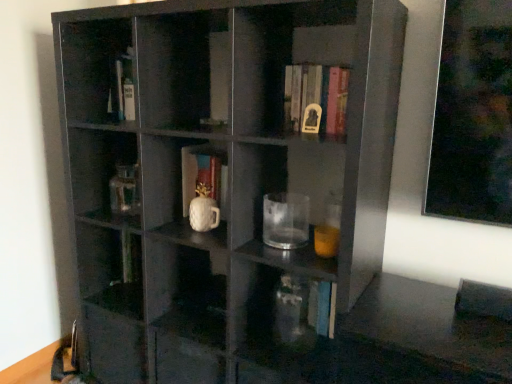
Question: Is transparent glass mug at center positioned before matte black shelf at center?

Choices:
 (A) yes
 (B) no

Answer: (B)

Question: Is transparent glass mug at center wider than matte black shelf at center?

Choices:
 (A) no
 (B) yes

Answer: (A)

Question: Is transparent glass mug at center facing away from matte black shelf at center?

Choices:
 (A) no
 (B) yes

Answer: (B)

Question: Can you confirm if transparent glass mug at center is bigger than matte black shelf at center?

Choices:
 (A) no
 (B) yes

Answer: (A)

Question: Considering the relative positions of transparent glass mug at center and matte black shelf at center in the image provided, is transparent glass mug at center to the left of matte black shelf at center from the viewer's perspective?

Choices:
 (A) no
 (B) yes

Answer: (A)

Question: From a real-world perspective, is transparent glass mug at center beneath matte black shelf at center?

Choices:
 (A) no
 (B) yes

Answer: (A)

Question: Is white glossy mug at center, the 1th book in the bottom-to-top sequence, directly adjacent to transparent glass mug at center?

Choices:
 (A) no
 (B) yes

Answer: (A)

Question: From a real-world perspective, is white glossy mug at center, which is the first book from left to right, below transparent glass mug at center?

Choices:
 (A) yes
 (B) no

Answer: (B)

Question: Does white glossy mug at center, the 2th book positioned from the right, have a lesser width compared to transparent glass mug at center?

Choices:
 (A) no
 (B) yes

Answer: (A)

Question: Is the position of white glossy mug at center, which is the first book from left to right, less distant than that of transparent glass mug at center?

Choices:
 (A) yes
 (B) no

Answer: (B)

Question: From a real-world perspective, is white glossy mug at center, which is the second book in front-to-back order, located higher than transparent glass mug at center?

Choices:
 (A) yes
 (B) no

Answer: (A)

Question: From the image's perspective, is white glossy mug at center, the 1th book in the bottom-to-top sequence, on transparent glass mug at center?

Choices:
 (A) yes
 (B) no

Answer: (A)

Question: From the image's perspective, is transparent glass mug at center located above transparent glass vase at lower center?

Choices:
 (A) no
 (B) yes

Answer: (B)